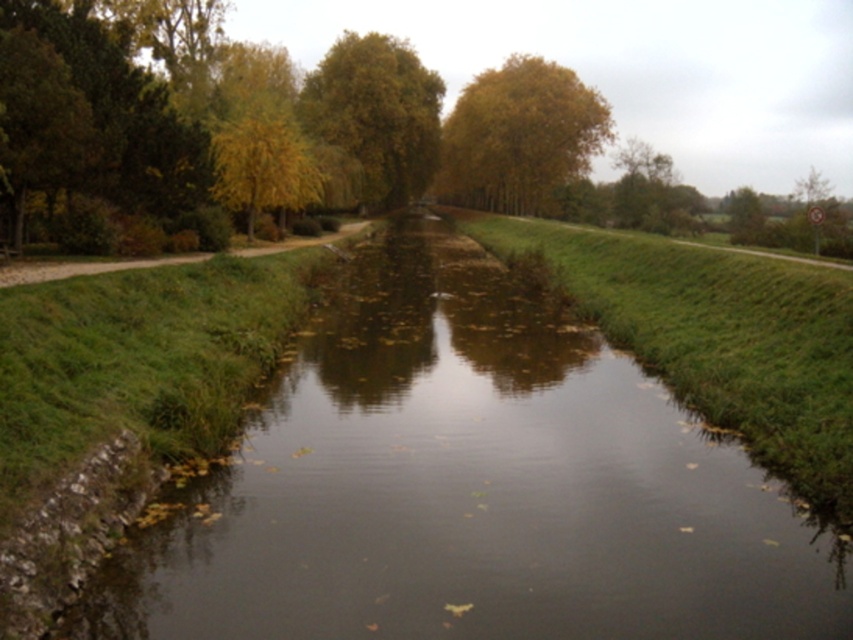
Can you confirm if yellow-green foliage at upper center is positioned above yellow leafy tree at center?

Indeed, yellow-green foliage at upper center is positioned over yellow leafy tree at center.

You are a GUI agent. You are given a task and a screenshot of the screen. Output one action in this format:
    pyautogui.click(x=<x>, y=<y>)
    Task: Click on the yellow-green foliage at upper center
    Image resolution: width=853 pixels, height=640 pixels.
    Given the screenshot: What is the action you would take?
    pyautogui.click(x=376, y=113)

The image size is (853, 640). What are the coordinates of `yellow-green foliage at upper center` in the screenshot? It's located at (376, 113).

Does brown grassy stream at center have a greater height compared to yellow leafy tree at upper center?

In fact, brown grassy stream at center may be shorter than yellow leafy tree at upper center.

Where is `brown grassy stream at center`? brown grassy stream at center is located at coordinates (469, 486).

Can you confirm if brown grassy stream at center is wider than yellow leafy tree at center?

Yes, brown grassy stream at center is wider than yellow leafy tree at center.

Between brown grassy stream at center and yellow leafy tree at center, which one appears on the left side from the viewer's perspective?

yellow leafy tree at center

Between point (97, 595) and point (244, 128), which one is positioned behind?

Point (244, 128)

At what (x,y) coordinates should I click in order to perform the action: click on brown grassy stream at center. Please return your answer as a coordinate pair (x, y). Looking at the image, I should click on (469, 486).